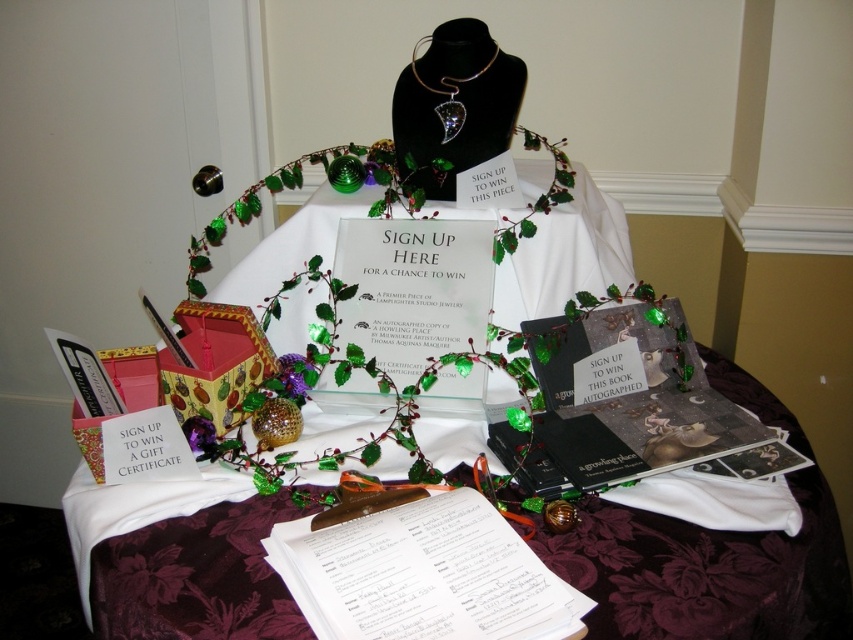
Does burgundy velvet tablecloth at lower center appear under swarovski crystal pendant at center?

Correct, burgundy velvet tablecloth at lower center is located below swarovski crystal pendant at center.

Who is positioned more to the right, burgundy velvet tablecloth at lower center or swarovski crystal pendant at center?

burgundy velvet tablecloth at lower center

You are a GUI agent. You are given a task and a screenshot of the screen. Output one action in this format:
    pyautogui.click(x=<x>, y=<y>)
    Task: Click on the burgundy velvet tablecloth at lower center
    The width and height of the screenshot is (853, 640).
    Given the screenshot: What is the action you would take?
    [x=708, y=572]

I want to click on burgundy velvet tablecloth at lower center, so click(708, 572).